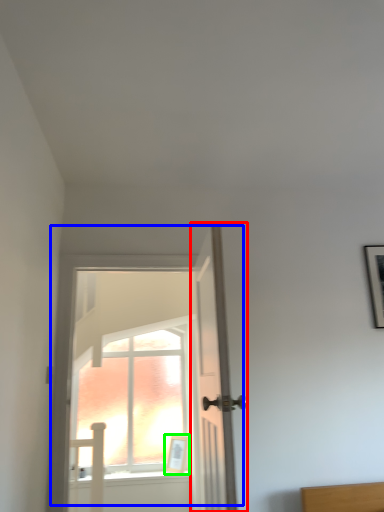
Question: Which object is the closest to the door (highlighted by a red box)? Choose among these: door (highlighted by a blue box) or picture frame (highlighted by a green box).

Choices:
 (A) door
 (B) picture frame

Answer: (B)